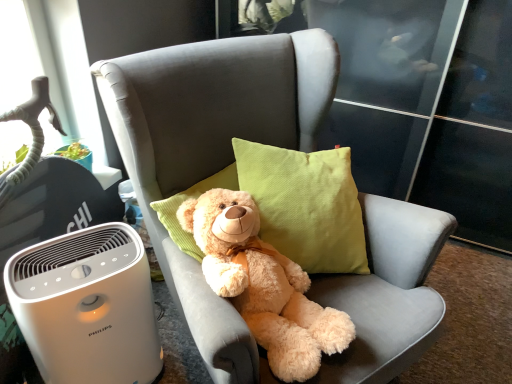
What do you see at coordinates (263, 285) in the screenshot? The height and width of the screenshot is (384, 512). I see `fluffy beige teddy bear at center` at bounding box center [263, 285].

Where is `soft gray fabric chair at center`? Image resolution: width=512 pixels, height=384 pixels. soft gray fabric chair at center is located at coordinates (213, 148).

The height and width of the screenshot is (384, 512). Describe the element at coordinates (213, 148) in the screenshot. I see `soft gray fabric chair at center` at that location.

Where is `white plastic air purifier at lower left`? white plastic air purifier at lower left is located at coordinates (87, 306).

Identify the location of home appliance located behind the soft gray fabric chair at center. (x=87, y=306).

Is soft gray fabric chair at center oriented away from white plastic air purifier at lower left?

No, soft gray fabric chair at center is not facing the opposite direction of white plastic air purifier at lower left.

Which object is thinner, soft gray fabric chair at center or white plastic air purifier at lower left?

Thinner between the two is white plastic air purifier at lower left.

Which of these two, soft gray fabric chair at center or white plastic air purifier at lower left, is bigger?

With larger size is soft gray fabric chair at center.

Is point (137, 358) closer or farther from the camera than point (253, 80)?

Point (137, 358) is positioned closer to the camera compared to point (253, 80).

Is the depth of white plastic air purifier at lower left less than that of soft gray fabric chair at center?

That is False.

At what (x,y) coordinates should I click in order to perform the action: click on chair that appears above the white plastic air purifier at lower left (from the image's perspective). Please return your answer as a coordinate pair (x, y). The width and height of the screenshot is (512, 384). Looking at the image, I should click on (213, 148).

Who is smaller, white plastic air purifier at lower left or soft gray fabric chair at center?

Smaller between the two is white plastic air purifier at lower left.

Is fluffy beige teddy bear at center to the right of soft gray fabric chair at center from the viewer's perspective?

No, fluffy beige teddy bear at center is not to the right of soft gray fabric chair at center.

Which is behind, point (334, 327) or point (167, 243)?

The point (167, 243) is behind.

From the image's perspective, which is above, fluffy beige teddy bear at center or soft gray fabric chair at center?

soft gray fabric chair at center, from the image's perspective.

Which of these two, fluffy beige teddy bear at center or white plastic air purifier at lower left, stands shorter?

With less height is fluffy beige teddy bear at center.

Based on their positions, is fluffy beige teddy bear at center located to the left or right of white plastic air purifier at lower left?

fluffy beige teddy bear at center is to the right of white plastic air purifier at lower left.

From the image's perspective, is fluffy beige teddy bear at center above white plastic air purifier at lower left?

Yes, from the image's perspective, fluffy beige teddy bear at center is above white plastic air purifier at lower left.

Can we say fluffy beige teddy bear at center lies outside white plastic air purifier at lower left?

Absolutely, fluffy beige teddy bear at center is external to white plastic air purifier at lower left.

Can you confirm if white plastic air purifier at lower left is taller than fluffy beige teddy bear at center?

Yes, white plastic air purifier at lower left is taller than fluffy beige teddy bear at center.

In the scene shown: Measure the distance between white plastic air purifier at lower left and fluffy beige teddy bear at center.

white plastic air purifier at lower left and fluffy beige teddy bear at center are 13.77 inches apart.

From the image's perspective, does white plastic air purifier at lower left appear higher than fluffy beige teddy bear at center?

No, from the image's perspective, white plastic air purifier at lower left is not above fluffy beige teddy bear at center.

Looking at their sizes, would you say white plastic air purifier at lower left is wider or thinner than fluffy beige teddy bear at center?

Clearly, white plastic air purifier at lower left has less width compared to fluffy beige teddy bear at center.

In terms of width, does soft gray fabric chair at center look wider or thinner when compared to fluffy beige teddy bear at center?

soft gray fabric chair at center is wider than fluffy beige teddy bear at center.

How much distance is there between soft gray fabric chair at center and fluffy beige teddy bear at center?

soft gray fabric chair at center and fluffy beige teddy bear at center are 7.51 inches apart from each other.

From the image's perspective, is soft gray fabric chair at center on top of fluffy beige teddy bear at center?

Yes, from the image's perspective, soft gray fabric chair at center is above fluffy beige teddy bear at center.

From a real-world perspective, is soft gray fabric chair at center below fluffy beige teddy bear at center?

Correct, in the physical world, soft gray fabric chair at center is lower than fluffy beige teddy bear at center.

This screenshot has width=512, height=384. In order to click on chair positioned vertically above the white plastic air purifier at lower left (from a real-world perspective) in this screenshot , I will do `click(213, 148)`.

This screenshot has width=512, height=384. What are the coordinates of `chair lying on the right of white plastic air purifier at lower left` in the screenshot? It's located at coord(213,148).

From the image, which object appears to be farther from soft gray fabric chair at center, fluffy beige teddy bear at center or white plastic air purifier at lower left?

white plastic air purifier at lower left is further to soft gray fabric chair at center.

Estimate the real-world distances between objects in this image. Which object is further from fluffy beige teddy bear at center, soft gray fabric chair at center or white plastic air purifier at lower left?

white plastic air purifier at lower left lies further to fluffy beige teddy bear at center than the other object.

Which object lies nearer to the anchor point white plastic air purifier at lower left, fluffy beige teddy bear at center or soft gray fabric chair at center?

soft gray fabric chair at center is positioned closer to the anchor white plastic air purifier at lower left.

Consider the image. Based on their spatial positions, is white plastic air purifier at lower left or fluffy beige teddy bear at center further from soft gray fabric chair at center?

white plastic air purifier at lower left is further to soft gray fabric chair at center.

Looking at the image, which one is located further to white plastic air purifier at lower left, soft gray fabric chair at center or fluffy beige teddy bear at center?

Among the two, fluffy beige teddy bear at center is located further to white plastic air purifier at lower left.

Based on their spatial positions, is white plastic air purifier at lower left or soft gray fabric chair at center further from fluffy beige teddy bear at center?

white plastic air purifier at lower left lies further to fluffy beige teddy bear at center than the other object.

This screenshot has height=384, width=512. What are the coordinates of `teddy bear between white plastic air purifier at lower left and soft gray fabric chair at center` in the screenshot? It's located at (263, 285).